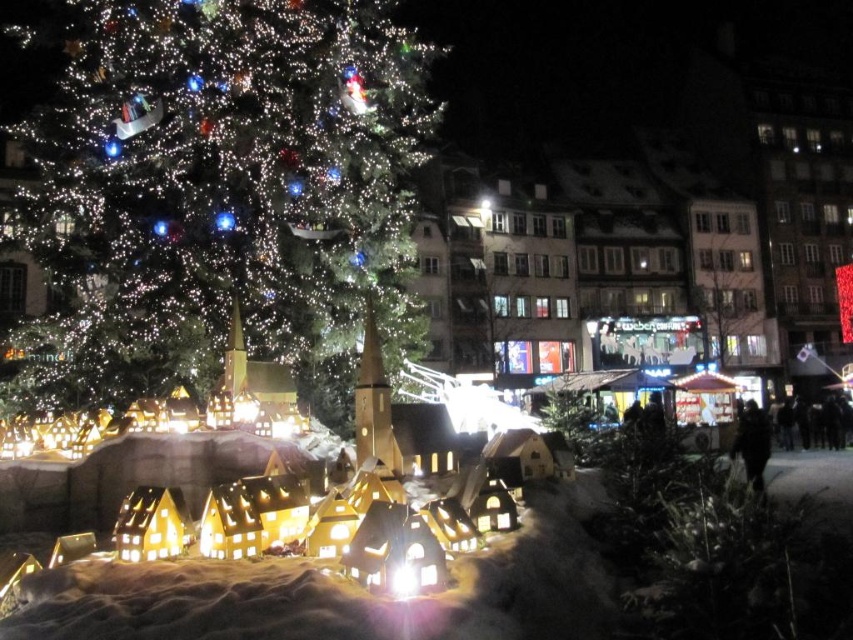
Is point (102, 147) more distant than point (769, 440)?

No, it is not.

Is illuminated matte green christmas tree at upper left to the left of black fabric person at lower right from the viewer's perspective?

Yes, illuminated matte green christmas tree at upper left is to the left of black fabric person at lower right.

Find the location of `illuminated matte green christmas tree at upper left`. illuminated matte green christmas tree at upper left is located at coordinates (219, 182).

Locate an element on the screen. This screenshot has height=640, width=853. illuminated matte green christmas tree at upper left is located at coordinates (219, 182).